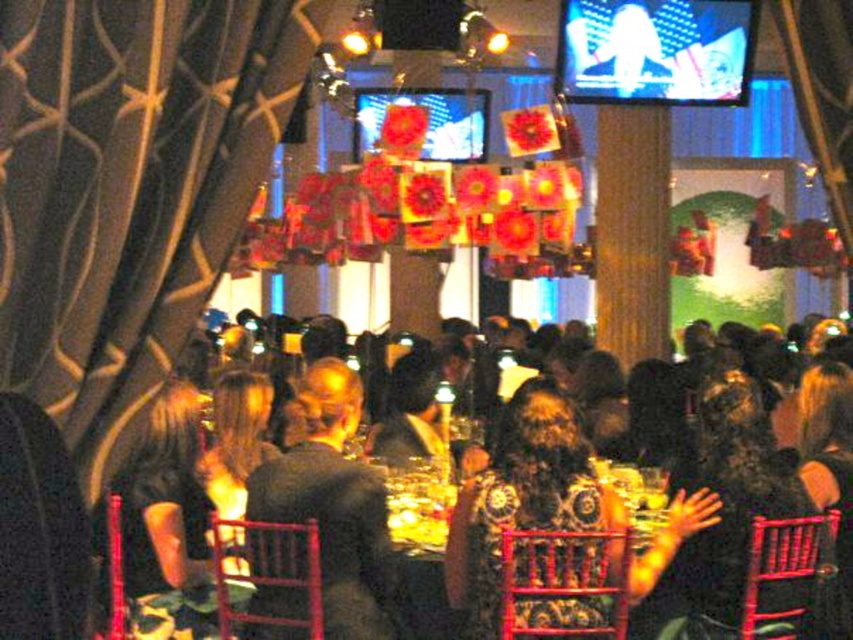
Question: Is velvet drapery at left closer to camera compared to dark hair at center?

Choices:
 (A) yes
 (B) no

Answer: (A)

Question: Is the position of dark hair at center more distant than that of dark brown leather jacket at center?

Choices:
 (A) yes
 (B) no

Answer: (B)

Question: Is velvet drapery at left behind dark gray suit at center?

Choices:
 (A) yes
 (B) no

Answer: (B)

Question: Estimate the real-world distances between objects in this image. Which object is farther from the dark hair at center?

Choices:
 (A) dark brown leather jacket at center
 (B) velvet drapery at left
 (C) dark gray suit at center

Answer: (B)

Question: Which of the following is the farthest from the observer?

Choices:
 (A) (537, 560)
 (B) (263, 77)

Answer: (A)

Question: Which point is closer to the camera?

Choices:
 (A) (485, 509)
 (B) (299, 426)
 (C) (38, 205)
 (D) (296, 602)

Answer: (C)